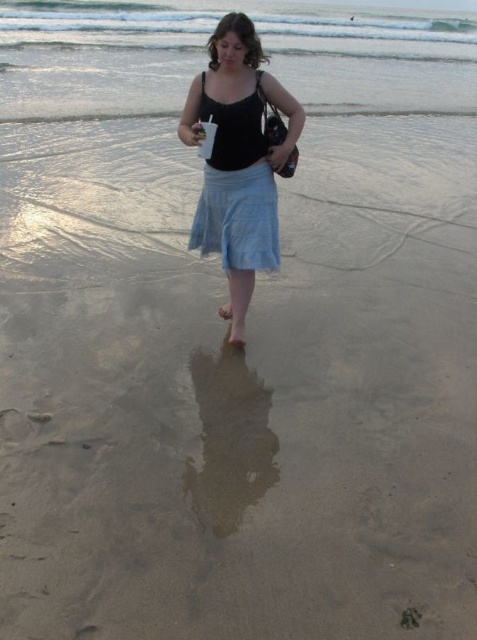
Question: Which point is farther to the camera?

Choices:
 (A) matte black tank top at center
 (B) light blue cotton skirt at center

Answer: (B)

Question: Considering the real-world distances, which object is closest to the clear water at upper center?

Choices:
 (A) matte black tank top at center
 (B) light blue cotton skirt at center

Answer: (B)

Question: Is matte black tank top at center closer to camera compared to light blue cotton skirt at center?

Choices:
 (A) yes
 (B) no

Answer: (A)

Question: Can you confirm if clear water at upper center is thinner than light blue cotton skirt at center?

Choices:
 (A) yes
 (B) no

Answer: (B)

Question: Is the position of clear water at upper center more distant than that of light blue cotton skirt at center?

Choices:
 (A) yes
 (B) no

Answer: (A)

Question: Which of the following is the farthest from the observer?

Choices:
 (A) light blue cotton skirt at center
 (B) matte black tank top at center

Answer: (A)